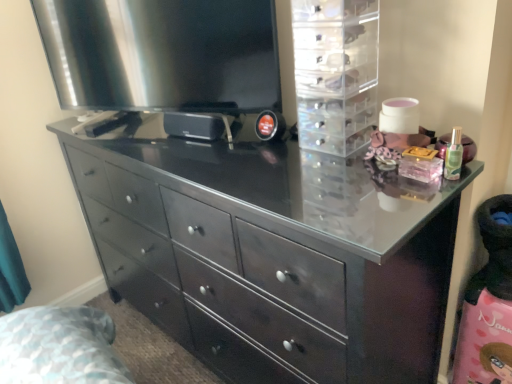
Question: Considering the positions of point (350, 104) and point (241, 48), is point (350, 104) closer or farther from the camera than point (241, 48)?

Choices:
 (A) farther
 (B) closer

Answer: (B)

Question: From their relative heights in the image, would you say transparent plastic drawers at upper right is taller or shorter than satin black television at upper left?

Choices:
 (A) tall
 (B) short

Answer: (B)

Question: Which is nearer to the transparent plastic drawers at upper right?

Choices:
 (A) black glossy chest of drawers at center
 (B) satin black television at upper left

Answer: (B)

Question: Considering the real-world distances, which object is farthest from the satin black television at upper left?

Choices:
 (A) transparent plastic drawers at upper right
 (B) black glossy chest of drawers at center

Answer: (B)